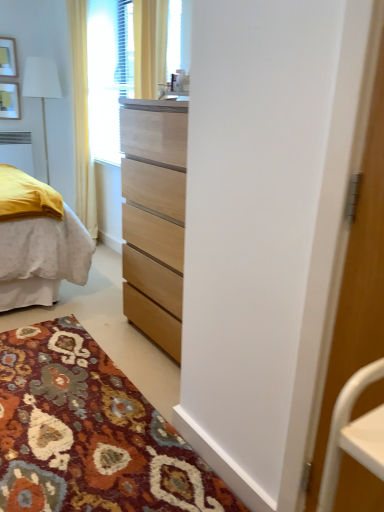
Question: From a real-world perspective, is white fabric lampshade at left on wooden picture frame at upper left, placed as the 2th picture frame when sorted from top to bottom?

Choices:
 (A) no
 (B) yes

Answer: (A)

Question: Is white fabric lampshade at left at the right side of wooden picture frame at upper left, placed as the 2th picture frame when sorted from top to bottom?

Choices:
 (A) no
 (B) yes

Answer: (B)

Question: Considering the relative sizes of white fabric lampshade at left and wooden picture frame at upper left, placed as the 2th picture frame when sorted from top to bottom, in the image provided, is white fabric lampshade at left wider than wooden picture frame at upper left, placed as the 2th picture frame when sorted from top to bottom,?

Choices:
 (A) no
 (B) yes

Answer: (B)

Question: Is white fabric lampshade at left at the left side of wooden picture frame at upper left, the first picture frame when ordered from bottom to top?

Choices:
 (A) yes
 (B) no

Answer: (B)

Question: Is white fabric lampshade at left far away from wooden picture frame at upper left, placed as the 2th picture frame when sorted from top to bottom?

Choices:
 (A) yes
 (B) no

Answer: (B)

Question: Is white fabric lampshade at left with wooden picture frame at upper left, placed as the 2th picture frame when sorted from top to bottom?

Choices:
 (A) no
 (B) yes

Answer: (A)

Question: From a real-world perspective, is wooden picture frame at upper left, placed as the 2th picture frame when sorted from top to bottom, below yellow fabric curtain at upper left?

Choices:
 (A) no
 (B) yes

Answer: (A)

Question: Is wooden picture frame at upper left, the first picture frame when ordered from bottom to top, shorter than yellow fabric curtain at upper left?

Choices:
 (A) yes
 (B) no

Answer: (A)

Question: Considering the relative sizes of wooden picture frame at upper left, placed as the 2th picture frame when sorted from top to bottom, and yellow fabric curtain at upper left in the image provided, is wooden picture frame at upper left, placed as the 2th picture frame when sorted from top to bottom, bigger than yellow fabric curtain at upper left?

Choices:
 (A) no
 (B) yes

Answer: (A)

Question: Can you confirm if wooden picture frame at upper left, the first picture frame when ordered from bottom to top, is wider than yellow fabric curtain at upper left?

Choices:
 (A) no
 (B) yes

Answer: (A)

Question: Could yellow fabric curtain at upper left be considered to be inside wooden picture frame at upper left, the first picture frame when ordered from bottom to top?

Choices:
 (A) no
 (B) yes

Answer: (A)

Question: Is wooden picture frame at upper left, the first picture frame when ordered from bottom to top, thinner than yellow fabric curtain at upper left?

Choices:
 (A) yes
 (B) no

Answer: (A)

Question: Would you say yellow fabric curtain at upper left contains white fabric lampshade at left?

Choices:
 (A) no
 (B) yes

Answer: (A)